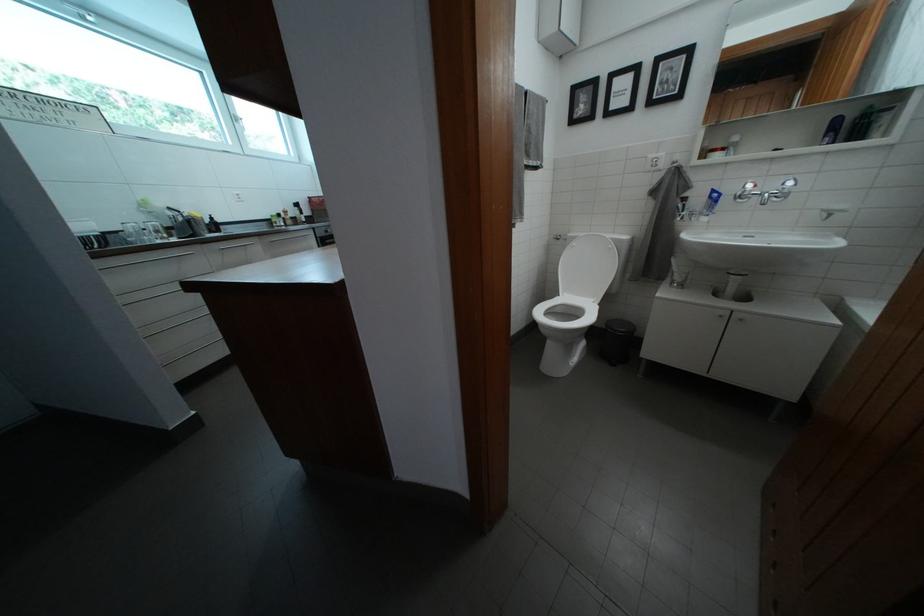
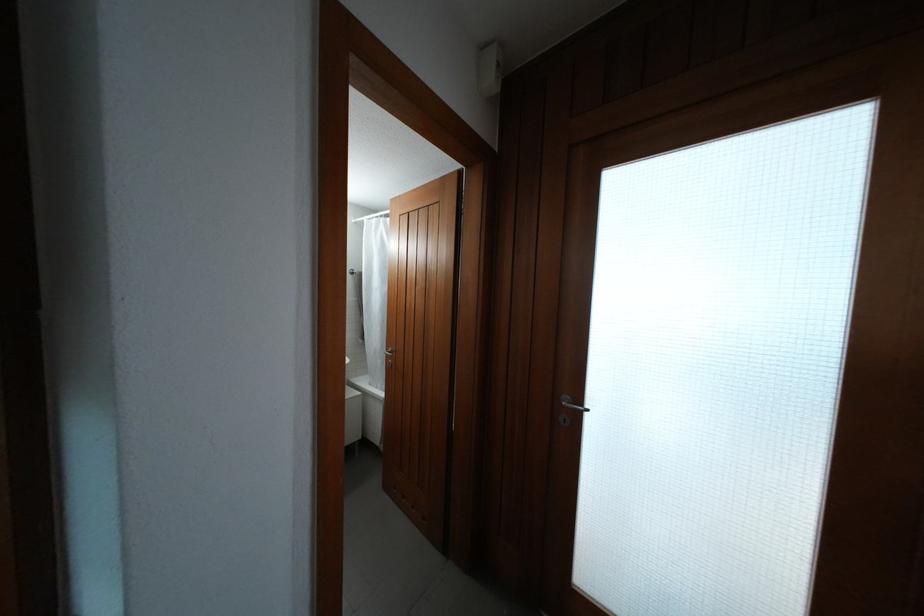
Question: The camera is either moving clockwise (left) or counter-clockwise (right) around the object. The first image is from the beginning of the video and the second image is from the end. Is the camera moving left or right when shooting the video?

Choices:
 (A) Left
 (B) Right

Answer: (A)